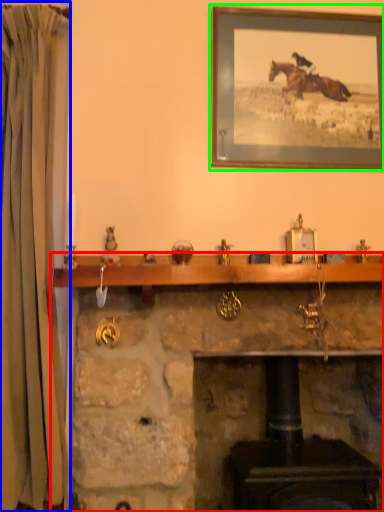
Question: Based on their relative distances, which object is nearer to fireplace (highlighted by a red box)? Choose from curtain (highlighted by a blue box) and picture frame (highlighted by a green box).

Choices:
 (A) curtain
 (B) picture frame

Answer: (A)